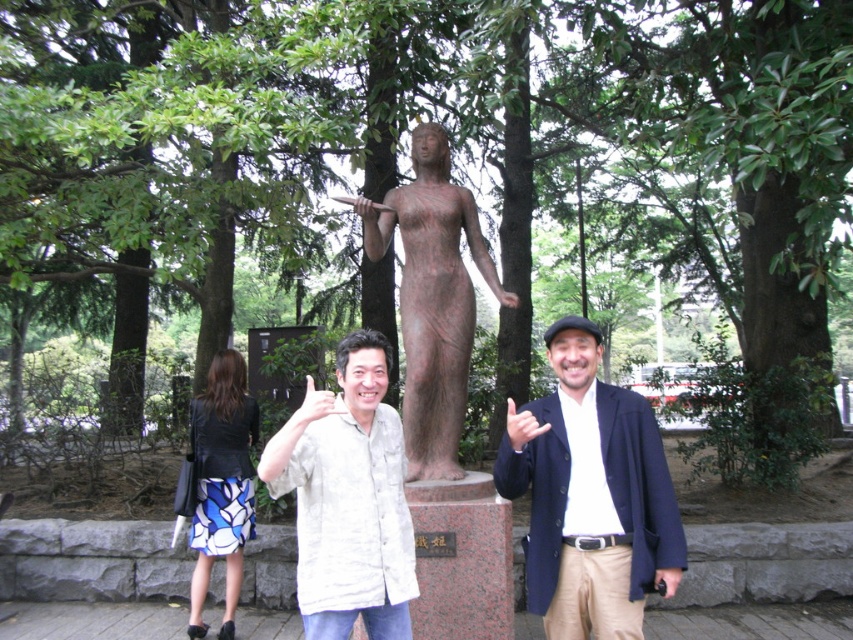
Question: Which of these objects is positioned closest to the dark blue fabric jacket at center?

Choices:
 (A) black leather jacket at lower left
 (B) bronze statue at center

Answer: (B)

Question: Is dark blue fabric jacket at center thinner than white textured shirt at center?

Choices:
 (A) no
 (B) yes

Answer: (A)

Question: Which point is farther to the camera?

Choices:
 (A) (206, 579)
 (B) (650, 552)
 (C) (369, 605)

Answer: (A)

Question: Does bronze statue at center have a lesser width compared to black leather jacket at lower left?

Choices:
 (A) yes
 (B) no

Answer: (B)

Question: Is dark blue fabric jacket at center to the right of white textured shirt at center from the viewer's perspective?

Choices:
 (A) no
 (B) yes

Answer: (B)

Question: Which object is farther from the camera taking this photo?

Choices:
 (A) white textured shirt at center
 (B) dark blue fabric jacket at center

Answer: (B)